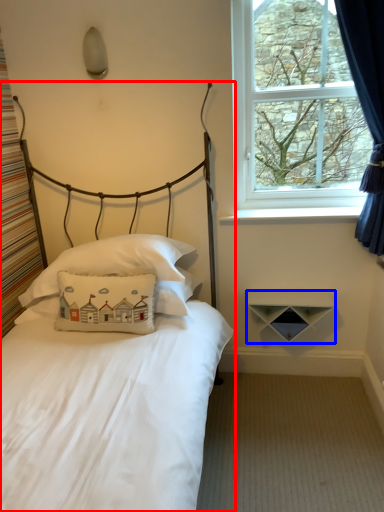
Question: Which object is closer to the camera taking this photo, bed (highlighted by a red box) or shelf (highlighted by a blue box)?

Choices:
 (A) bed
 (B) shelf

Answer: (A)